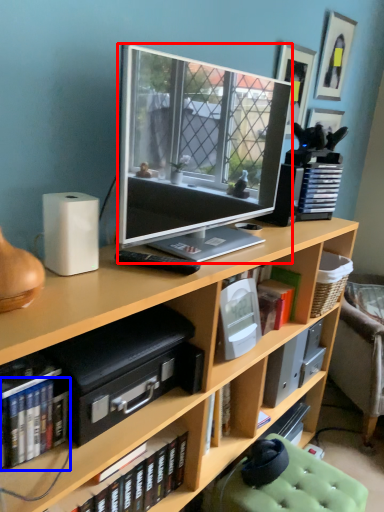
Question: Which of the following is the closest to the observer, television (highlighted by a red box) or book (highlighted by a blue box)?

Choices:
 (A) television
 (B) book

Answer: (A)